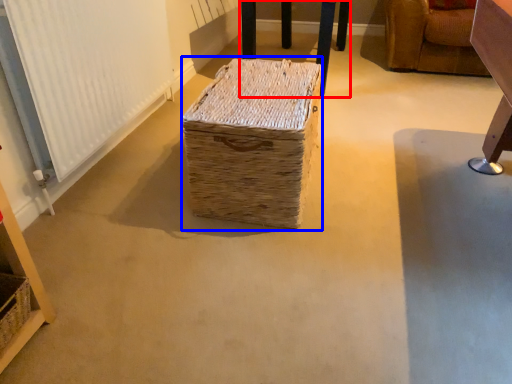
Question: Which object is further to the camera taking this photo, furniture (highlighted by a red box) or storage box (highlighted by a blue box)?

Choices:
 (A) furniture
 (B) storage box

Answer: (A)